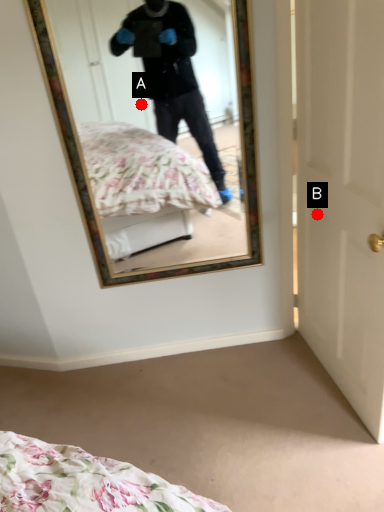
Question: Two points are circled on the image, labeled by A and B beside each circle. Which point is closer to the camera taking this photo?

Choices:
 (A) A is closer
 (B) B is closer

Answer: (A)